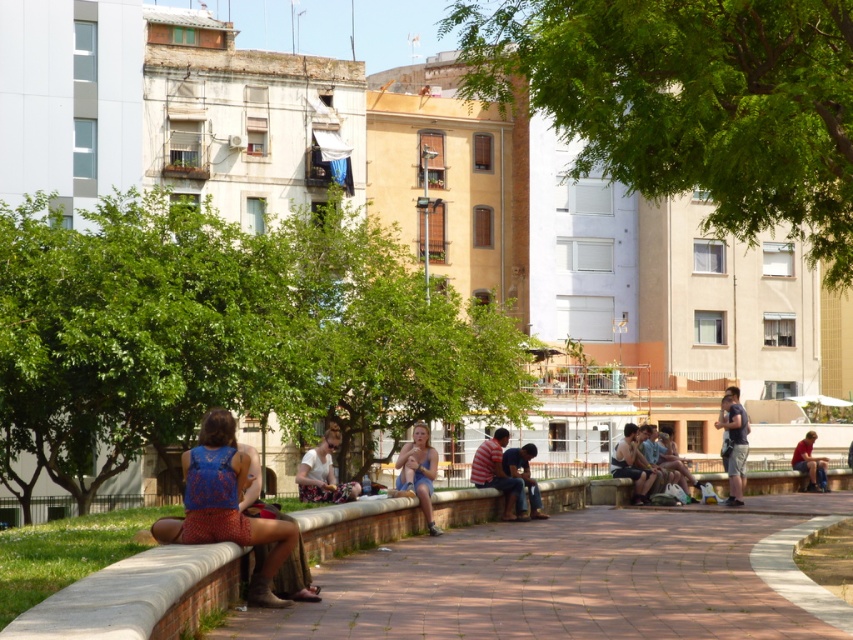
You are a photographer setting up a camera on the walkway. You want to capture both the blue printed dress at center and the light blue denim shorts at center in the same frame. Which object will require more space in the composition to avoid cropping?

The blue printed dress at center requires more space in the composition because its width is larger than the light blue denim shorts at center.